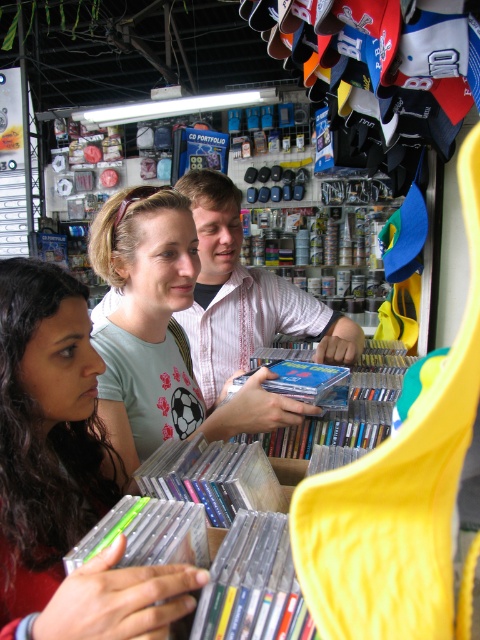
Question: Which point is closer to the camera?

Choices:
 (A) pyautogui.click(x=216, y=230)
 (B) pyautogui.click(x=120, y=483)
 (C) pyautogui.click(x=187, y=228)

Answer: (B)

Question: Considering the relative positions of matte green cd case at center and matte green t-shirt at center in the image provided, where is matte green cd case at center located with respect to matte green t-shirt at center?

Choices:
 (A) above
 (B) below

Answer: (B)

Question: Which point is farther from the camera taking this photo?

Choices:
 (A) (267, 278)
 (B) (124, 294)
 (C) (29, 396)

Answer: (A)

Question: Can you confirm if matte green t-shirt at center is thinner than white printed shirt at center?

Choices:
 (A) no
 (B) yes

Answer: (B)

Question: Is matte green cd case at center smaller than white printed shirt at center?

Choices:
 (A) yes
 (B) no

Answer: (A)

Question: Estimate the real-world distances between objects in this image. Which object is closer to the matte green t-shirt at center?

Choices:
 (A) white printed shirt at center
 (B) matte green cd case at center

Answer: (B)